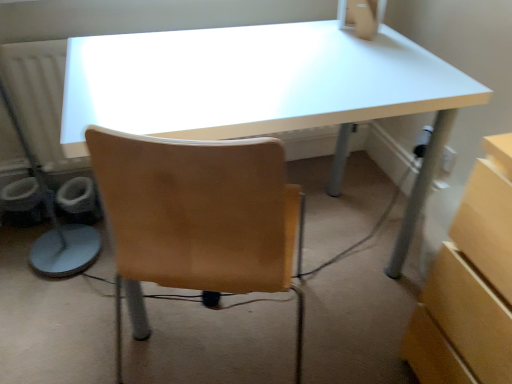
This screenshot has width=512, height=384. Find the location of `empty space that is to the right of matte beige desktop computer at upper center`. empty space that is to the right of matte beige desktop computer at upper center is located at coordinates (400, 44).